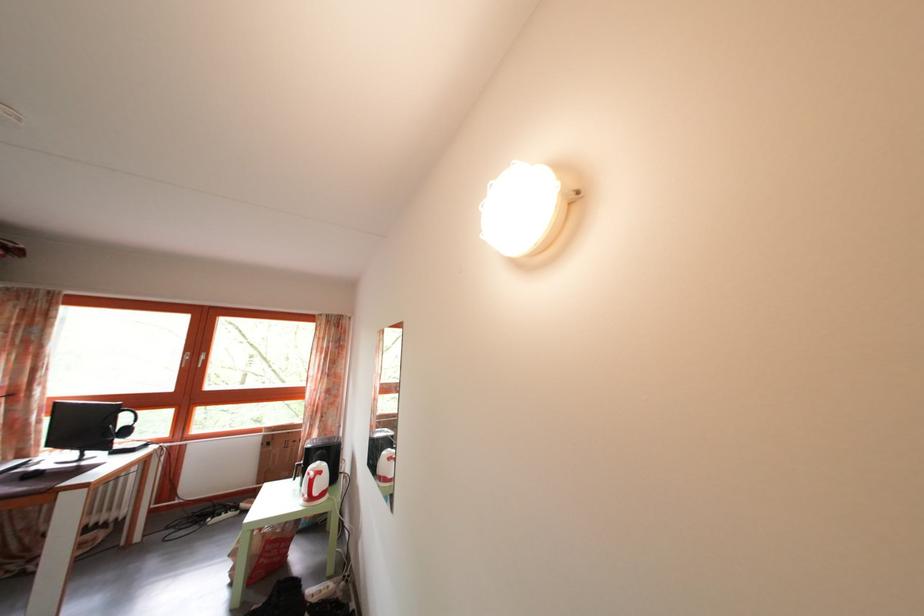
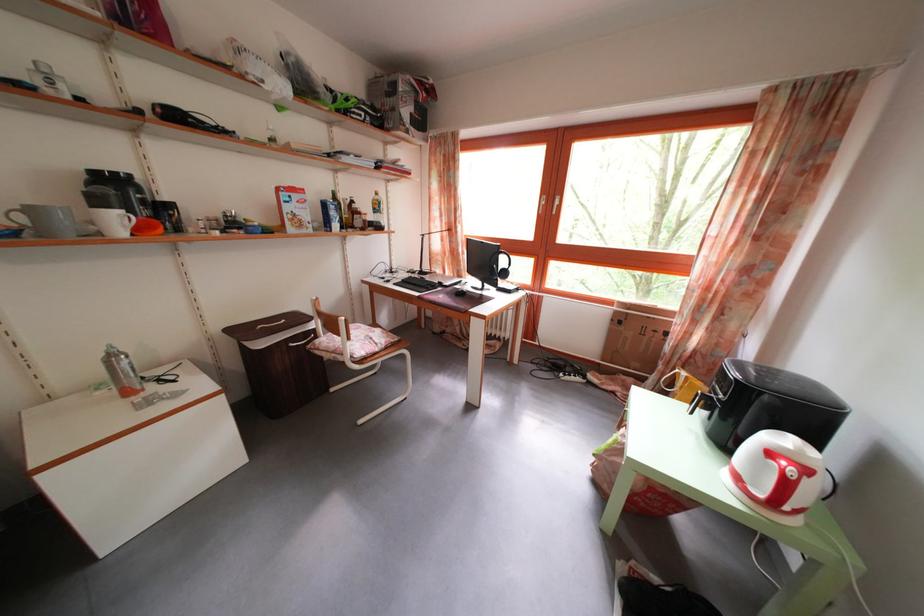
Find the pixel in the second image that matches the point at 327,480 in the first image.

(812, 477)